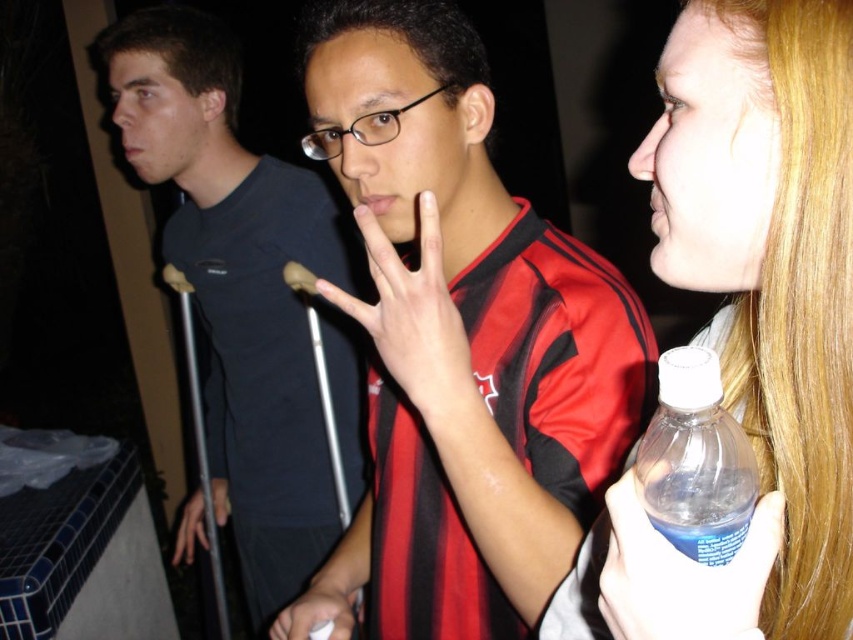
You are a photographer trying to capture a closeup of both the matte black hand at center and the white matte hand at center in the scene. Given that your camera can only focus on objects within 15 inches of each other, will you be able to get both hands in focus?

The matte black hand at center is 15.67 inches from the white matte hand at center, which is slightly beyond the camera focus range of 15 inches. Therefore, both hands cannot be in focus simultaneously.

What object is located at the coordinates point (415, 321) in the image?

The point (415, 321) marks the matte black hand at center.